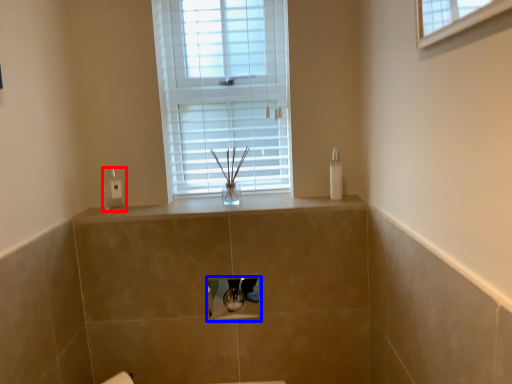
Question: Which object is closer to the camera taking this photo, soap dispenser (highlighted by a red box) or medicine cabinet (highlighted by a blue box)?

Choices:
 (A) soap dispenser
 (B) medicine cabinet

Answer: (B)